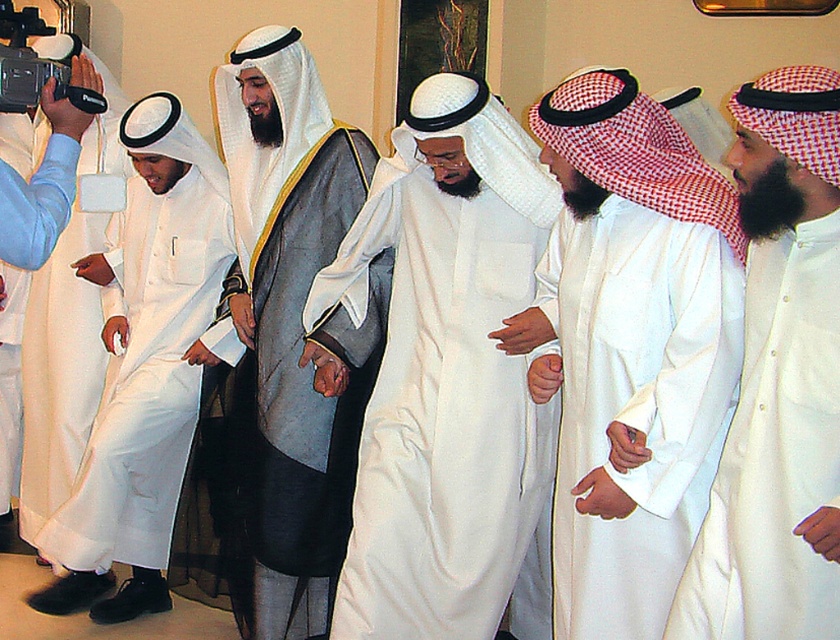
Question: Does matte gray robe at center appear over white matte robe at left?

Choices:
 (A) no
 (B) yes

Answer: (B)

Question: Among these objects, which one is nearest to the camera?

Choices:
 (A) white satin robe at center
 (B) white matte robe at center

Answer: (A)

Question: Among these points, which one is nearest to the camera?

Choices:
 (A) (769, 300)
 (B) (460, 326)
 (C) (29, 266)
 (D) (276, 520)

Answer: (A)

Question: Considering the relative positions of white satin robe at center and matte white camera at left in the image provided, where is white satin robe at center located with respect to matte white camera at left?

Choices:
 (A) left
 (B) right

Answer: (B)

Question: Which point is farther to the camera?

Choices:
 (A) white matte robe at center
 (B) matte white camera at left
 (C) white matte robe at left

Answer: (C)

Question: Is white matte kandura at center wider than matte white camera at left?

Choices:
 (A) no
 (B) yes

Answer: (B)